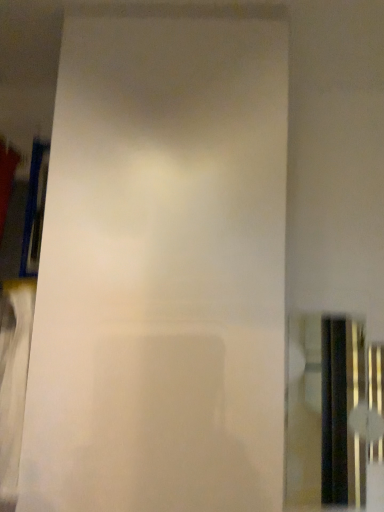
In order to click on white glossy door at center in this screenshot , I will do `click(161, 272)`.

Describe the element at coordinates (161, 272) in the screenshot. I see `white glossy door at center` at that location.

Where is `white glossy door at center`? The width and height of the screenshot is (384, 512). white glossy door at center is located at coordinates (161, 272).